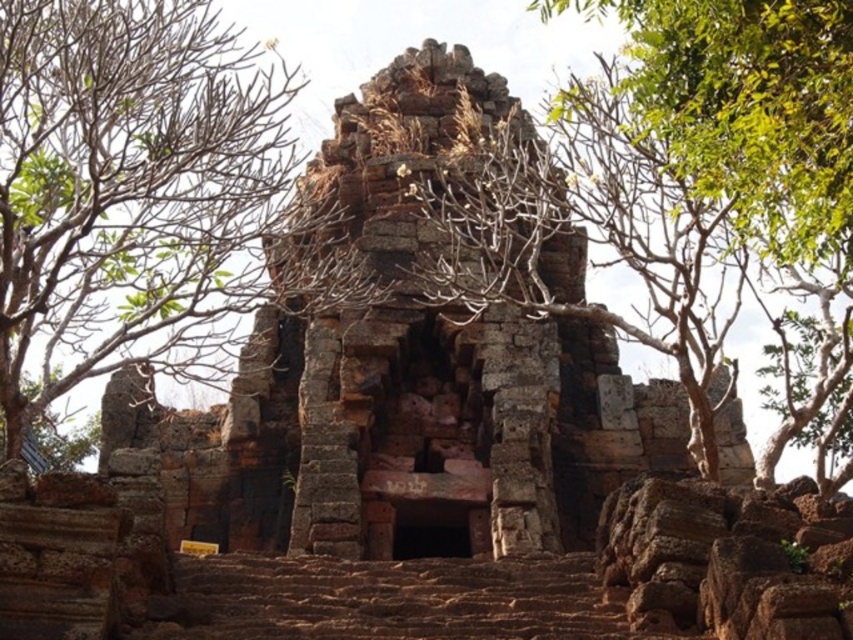
Between green leafy tree at left and green leafy tree at upper center, which one is positioned lower?

green leafy tree at left is below.

Is green leafy tree at left smaller than green leafy tree at upper center?

No.

At what (x,y) coordinates should I click in order to perform the action: click on green leafy tree at left. Please return your answer as a coordinate pair (x, y). This screenshot has height=640, width=853. Looking at the image, I should click on (131, 192).